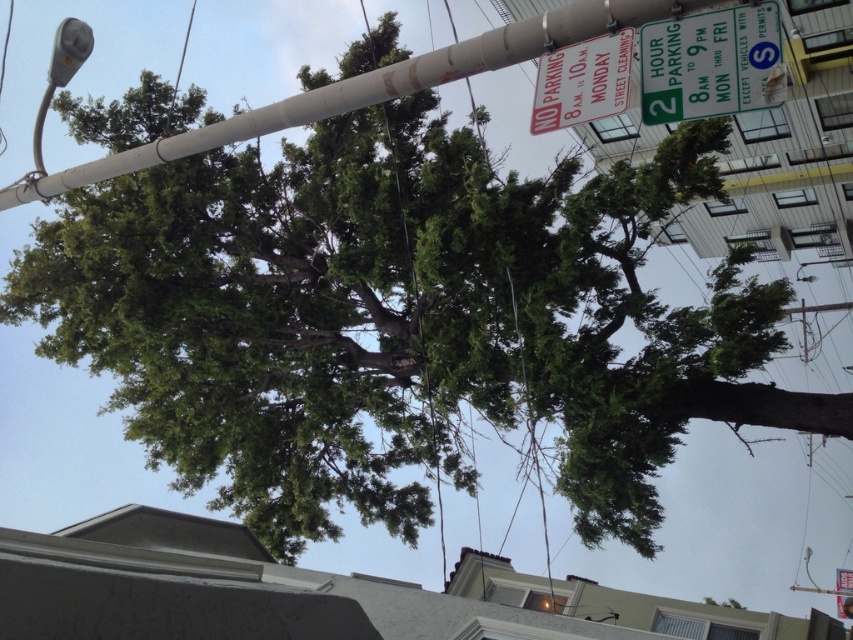
Can you confirm if smooth gray pole at upper center is positioned below metallic gray streetlight at upper left?

Yes.

This screenshot has width=853, height=640. Describe the element at coordinates (372, 88) in the screenshot. I see `smooth gray pole at upper center` at that location.

Identify the location of smooth gray pole at upper center. (372, 88).

Which is more to the right, smooth gray pole at upper center or white plastic sign at upper center?

Positioned to the right is white plastic sign at upper center.

Identify the location of smooth gray pole at upper center. (372, 88).

Image resolution: width=853 pixels, height=640 pixels. Identify the location of smooth gray pole at upper center. (372, 88).

Who is shorter, white plastic sign at upper center or metallic gray streetlight at upper left?

white plastic sign at upper center is shorter.

Does white plastic sign at upper center have a smaller size compared to metallic gray streetlight at upper left?

Yes.

Between point (531, 112) and point (74, 32), which one is positioned behind?

Point (531, 112)

This screenshot has height=640, width=853. I want to click on white plastic sign at upper center, so click(582, 81).